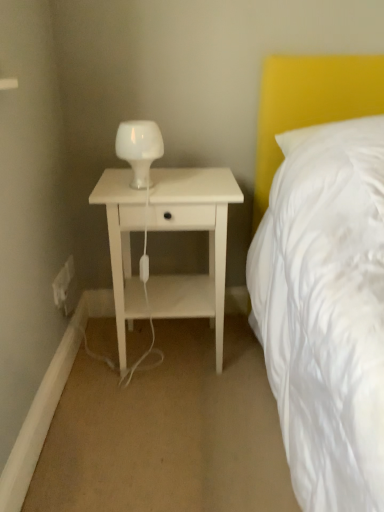
Locate an element on the screen. This screenshot has width=384, height=512. vacant area situated below white matte nightstand at center (from a real-world perspective) is located at coordinates (175, 366).